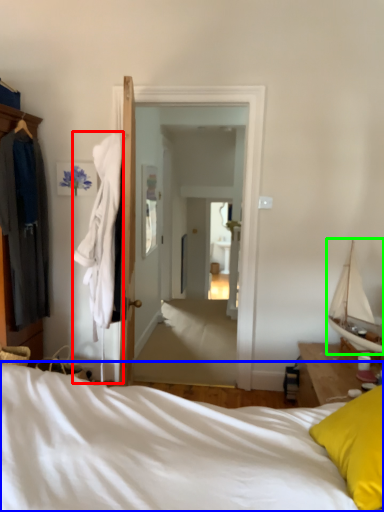
Question: Which object is the closest to the clothing (highlighted by a red box)? Choose among these: bed (highlighted by a blue box) or boat (highlighted by a green box).

Choices:
 (A) bed
 (B) boat

Answer: (A)